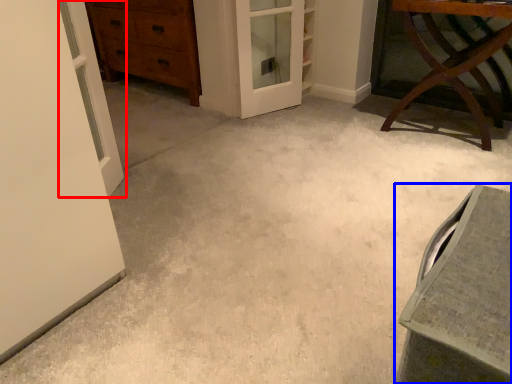
Question: Which object appears farthest to the camera in this image, door (highlighted by a red box) or vanity (highlighted by a blue box)?

Choices:
 (A) door
 (B) vanity

Answer: (A)